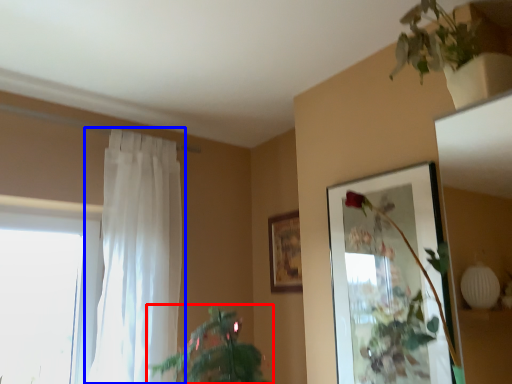
Question: Which of the following is the farthest to the observer, houseplant (highlighted by a red box) or curtain (highlighted by a blue box)?

Choices:
 (A) houseplant
 (B) curtain

Answer: (B)